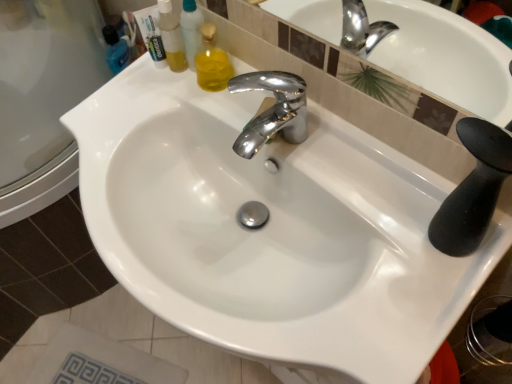
Identify the location of vacant position to the left of chrome metallic faucet at center. The image size is (512, 384). [x=196, y=107].